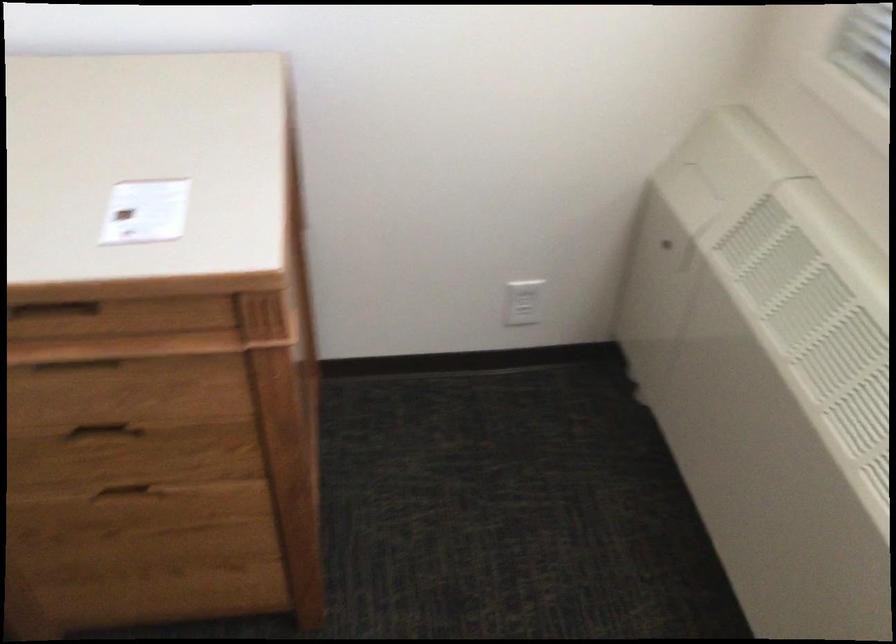
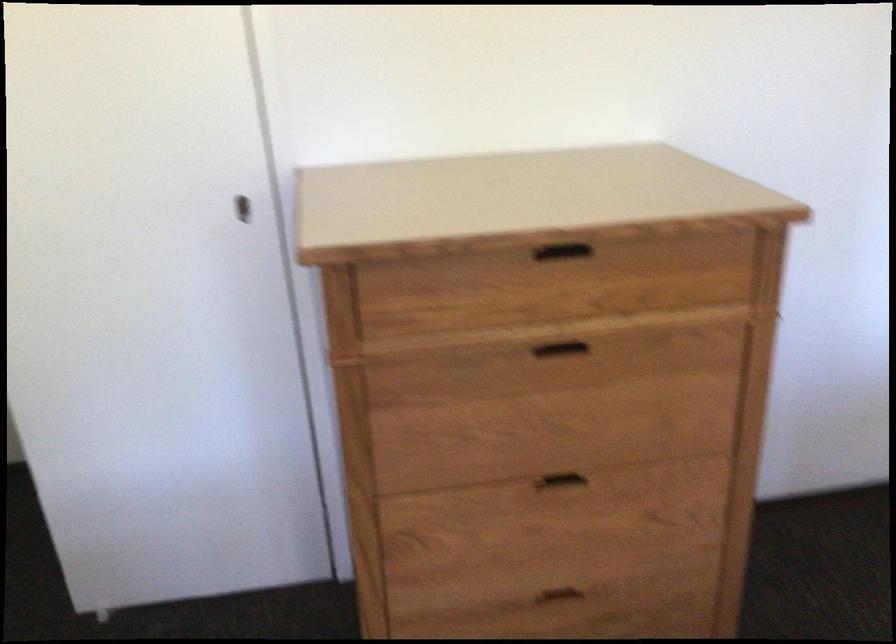
Based on the continuous images, in which direction is the camera rotating?

The rotation direction of the camera is left-down.